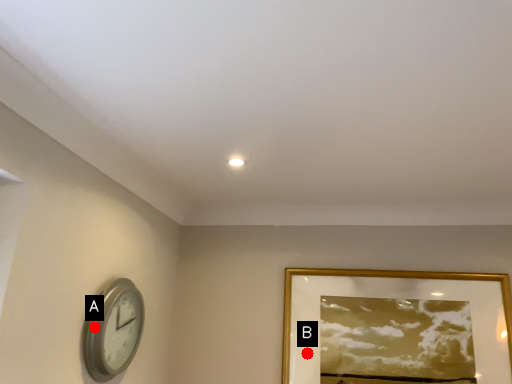
Question: Two points are circled on the image, labeled by A and B beside each circle. Which point is closer to the camera taking this photo?

Choices:
 (A) A is closer
 (B) B is closer

Answer: (A)